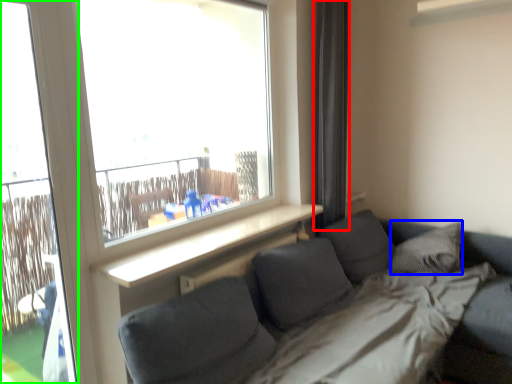
Question: Estimate the real-world distances between objects in this image. Which object is farther from curtain (highlighted by a red box), pillow (highlighted by a blue box) or screen door (highlighted by a green box)?

Choices:
 (A) pillow
 (B) screen door

Answer: (B)